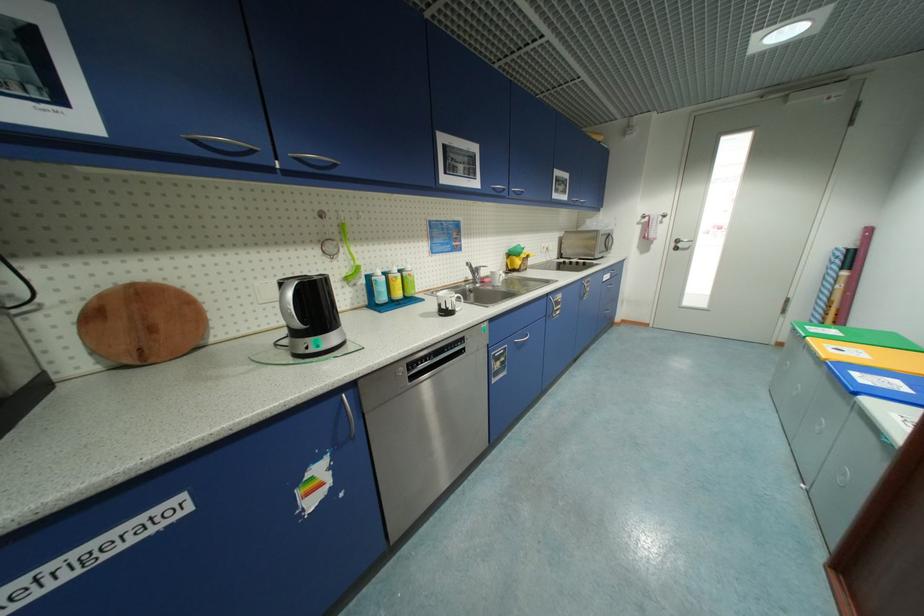
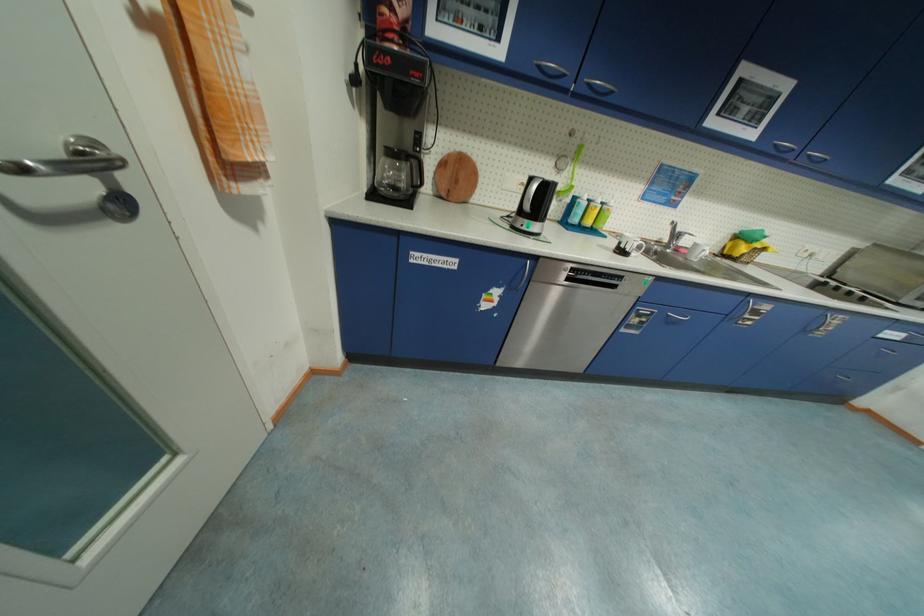
Where in the second image is the point corresponding to pixel 380 280 from the first image?

(584, 201)